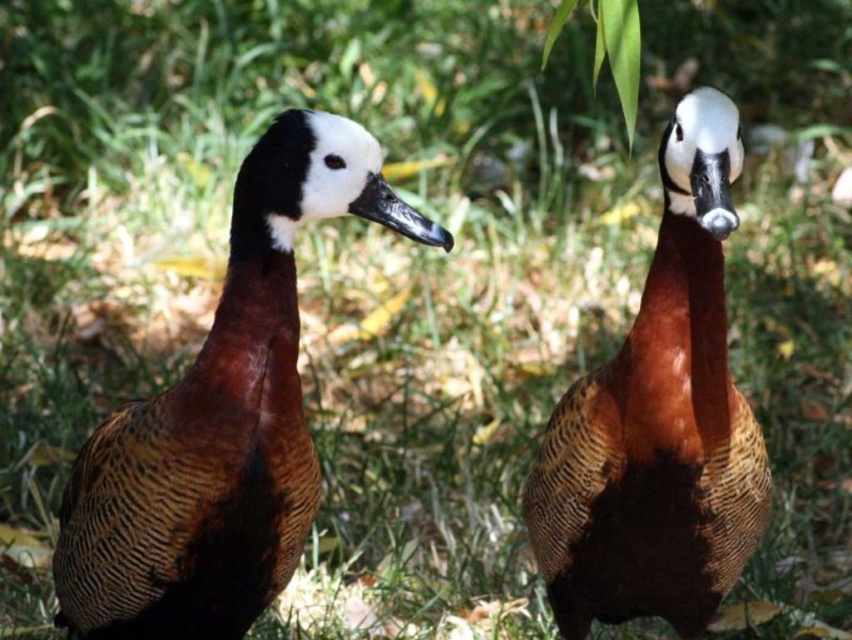
Question: Is brown textured duck at left to the right of brown textured duck at center from the viewer's perspective?

Choices:
 (A) no
 (B) yes

Answer: (A)

Question: Among these objects, which one is farthest from the camera?

Choices:
 (A) brown textured duck at center
 (B) brown textured duck at left

Answer: (A)

Question: Is brown textured duck at left bigger than brown textured duck at center?

Choices:
 (A) no
 (B) yes

Answer: (A)

Question: Which of the following is the farthest from the observer?

Choices:
 (A) (666, 573)
 (B) (225, 499)

Answer: (A)

Question: Is brown textured duck at left to the left of brown textured duck at center from the viewer's perspective?

Choices:
 (A) yes
 (B) no

Answer: (A)